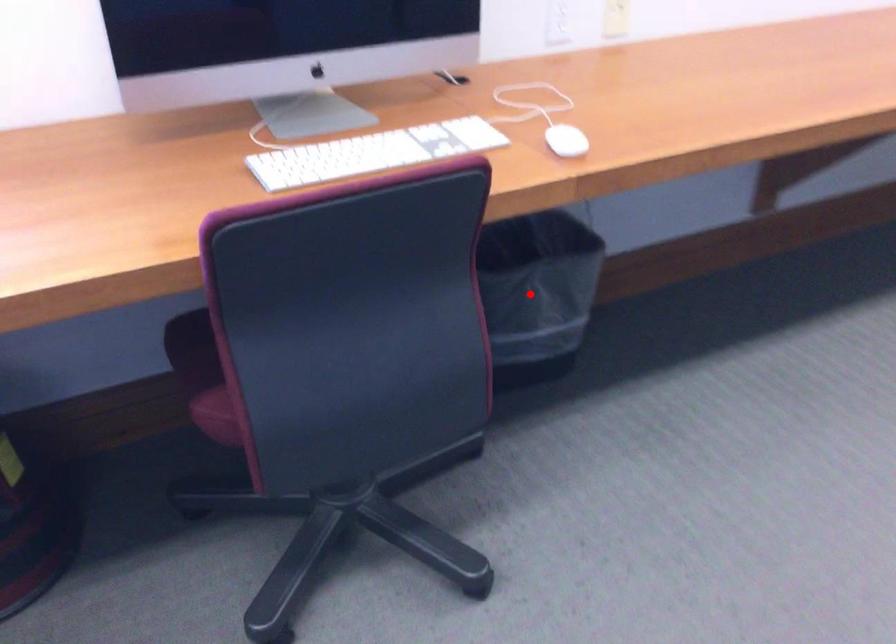
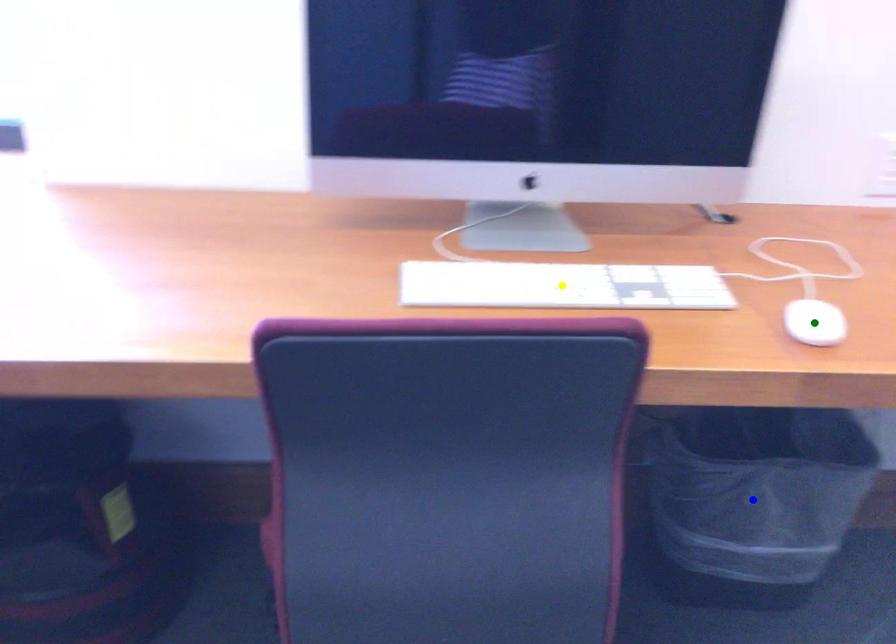
Question: I am providing you with two images of the same scene from different viewpoints. A red point is marked on the first image. You are given multiple points on the second image. Which spot in image 2 lines up with the point in image 1?

Choices:
 (A) blue point
 (B) yellow point
 (C) green point

Answer: (A)